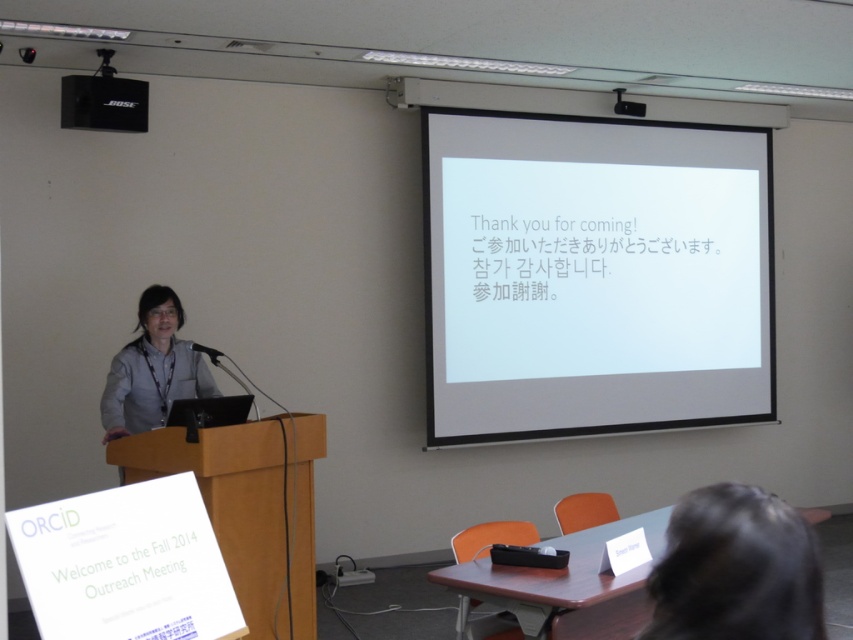
Question: Which object is the farthest from the black hair at lower right?

Choices:
 (A) black matte speaker at upper left
 (B) gray fabric shirt at left
 (C) white matte projector screen at upper right

Answer: (C)

Question: Which point is farther to the camera?

Choices:
 (A) (758, 506)
 (B) (114, 435)
 (C) (143, 108)
 (D) (659, 132)

Answer: (D)

Question: Is white matte projector screen at upper right thinner than black hair at lower right?

Choices:
 (A) yes
 (B) no

Answer: (B)

Question: Is gray fabric shirt at left to the right of black matte speaker at upper left from the viewer's perspective?

Choices:
 (A) yes
 (B) no

Answer: (A)

Question: Is black hair at lower right thinner than gray fabric shirt at left?

Choices:
 (A) yes
 (B) no

Answer: (A)

Question: Which object appears farthest from the camera in this image?

Choices:
 (A) black matte speaker at upper left
 (B) white matte projector screen at upper right
 (C) black hair at lower right

Answer: (B)